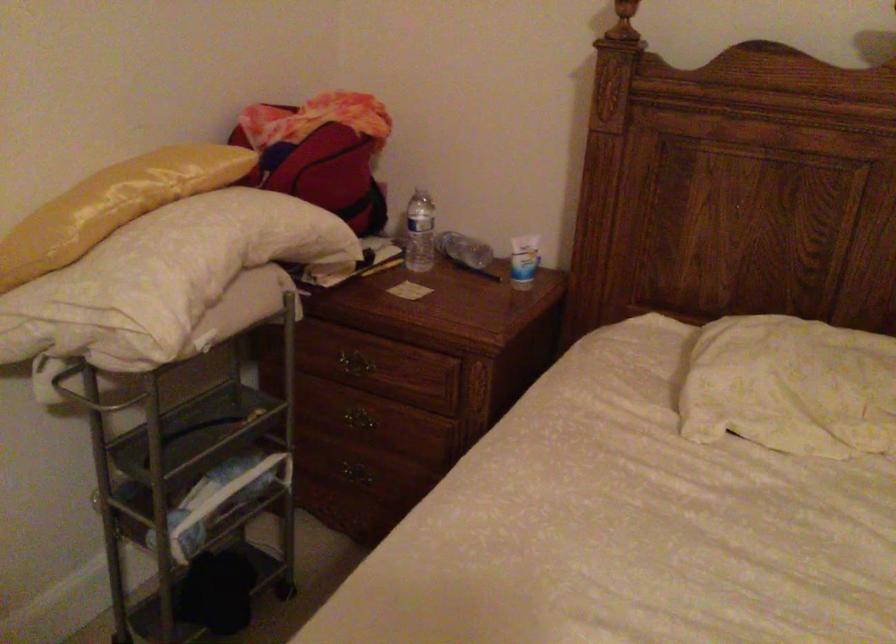
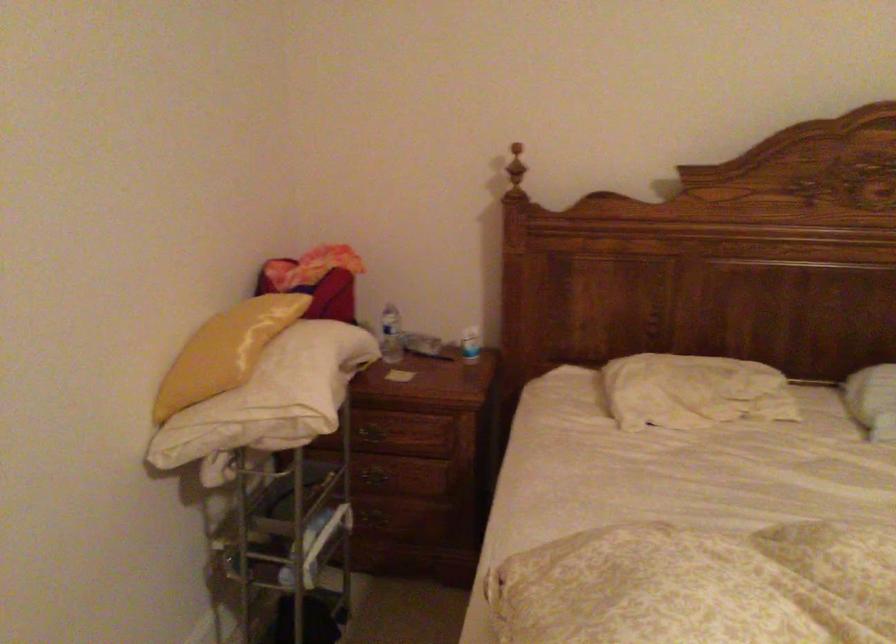
Where in the second image is the point corresponding to the point at 138,257 from the first image?

(287, 375)